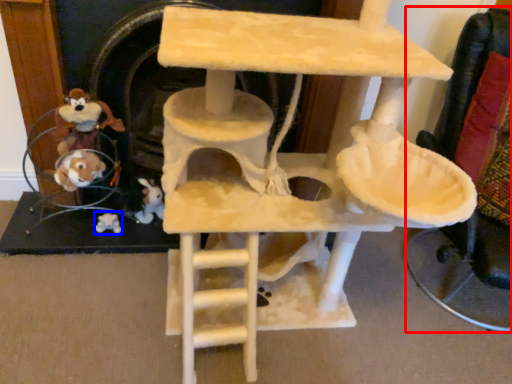
Question: Which object appears closest to the camera in this image, armchair (highlighted by a red box) or toy (highlighted by a blue box)?

Choices:
 (A) armchair
 (B) toy

Answer: (A)